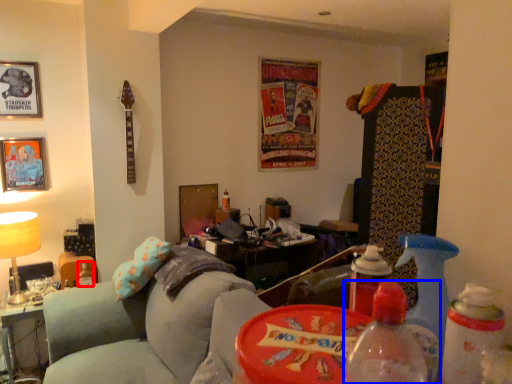
Question: Which point is further to the camera, bottle (highlighted by a red box) or bottle (highlighted by a blue box)?

Choices:
 (A) bottle
 (B) bottle

Answer: (A)